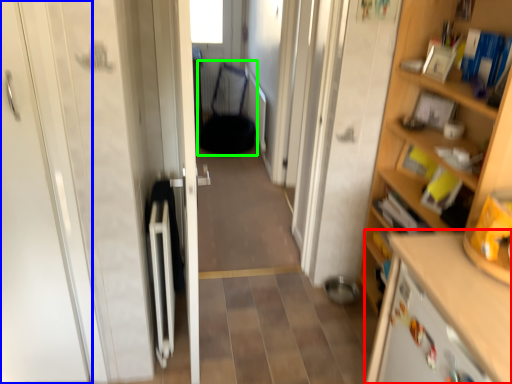
Question: Based on their relative distances, which object is nearer to cabinetry (highlighted by a red box)? Choose from door (highlighted by a blue box) and armchair (highlighted by a green box).

Choices:
 (A) door
 (B) armchair

Answer: (A)